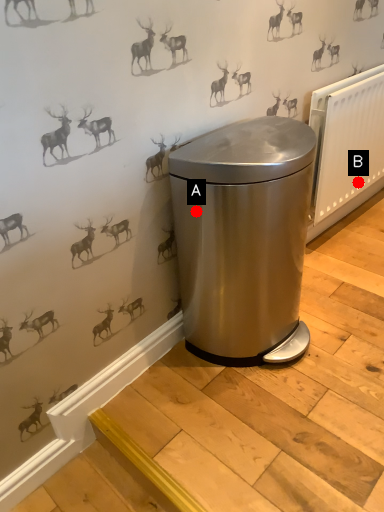
Question: Two points are circled on the image, labeled by A and B beside each circle. Among these points, which one is nearest to the camera?

Choices:
 (A) A is closer
 (B) B is closer

Answer: (A)